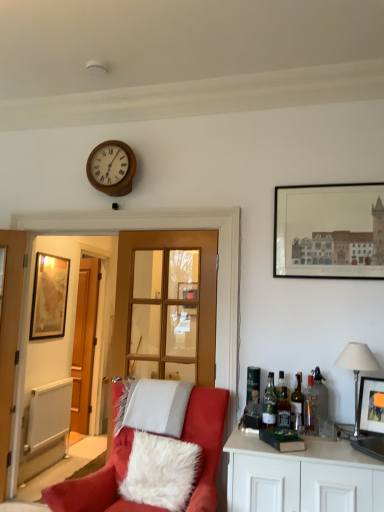
You are a GUI agent. You are given a task and a screenshot of the screen. Output one action in this format:
    pyautogui.click(x=<x>, y=<y>)
    Task: Click on the vacant area on top of clear glass door at center (from a real-world perspective)
    The image size is (384, 512).
    Given the screenshot: What is the action you would take?
    pyautogui.click(x=160, y=230)